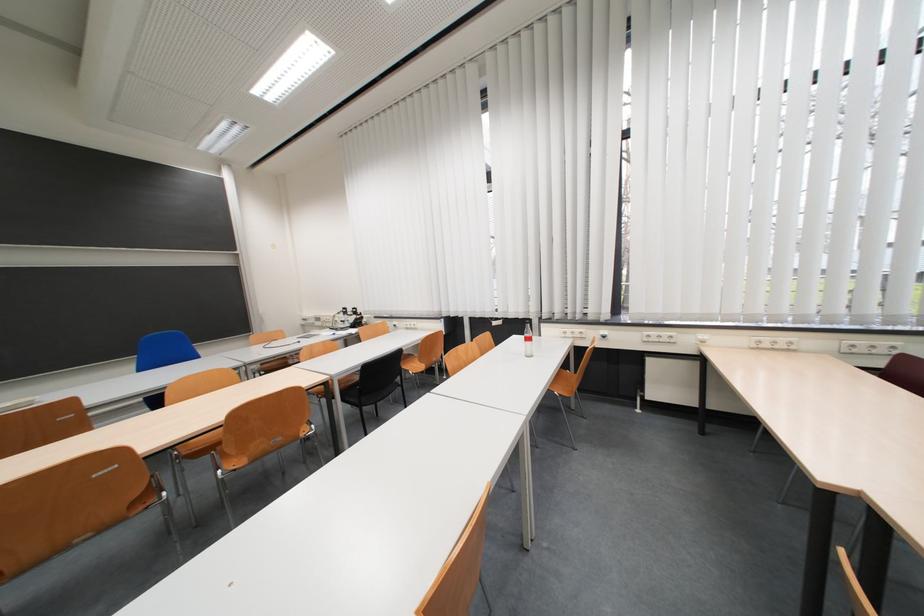
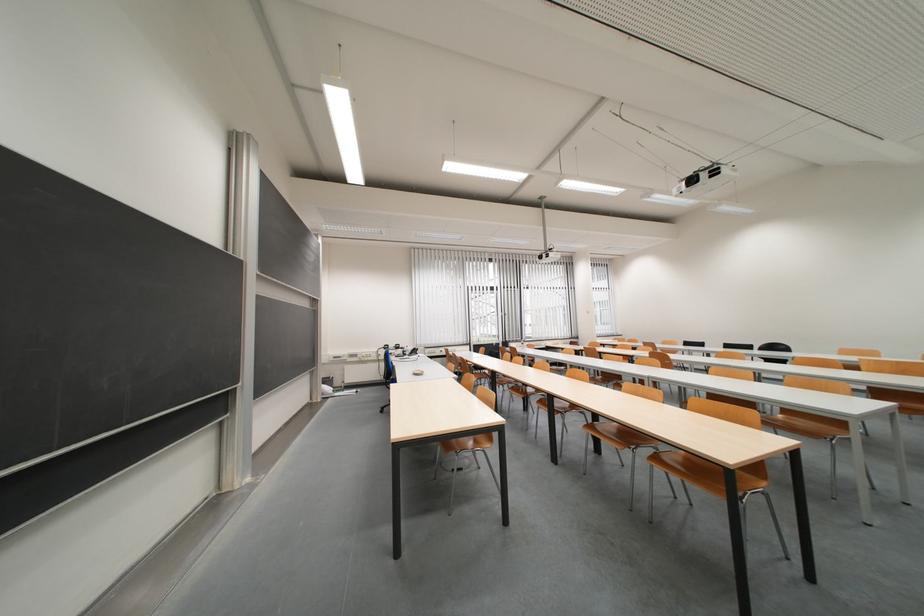
Question: I am providing you with two images of the same scene from different viewpoints. Which of the following objects are not visible in image2?

Choices:
 (A) chalkboard bottom rail
 (B) grey window curtain
 (C) small white bowl
 (D) wooden chair sitting surface

Answer: (D)